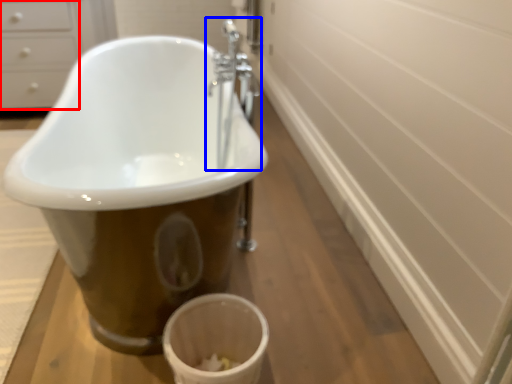
Question: Which point is closer to the camera, drawer (highlighted by a red box) or tap (highlighted by a blue box)?

Choices:
 (A) drawer
 (B) tap

Answer: (B)